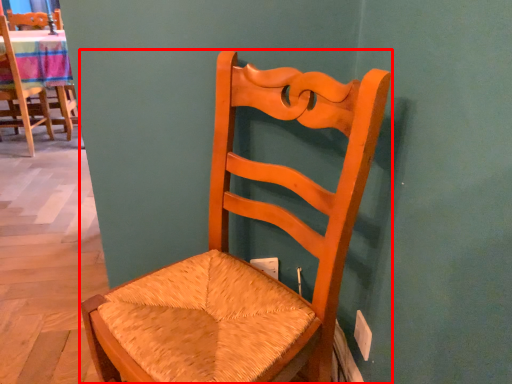
Question: Where is chair (annotated by the red box) located in relation to chair in the image?

Choices:
 (A) right
 (B) left

Answer: (A)